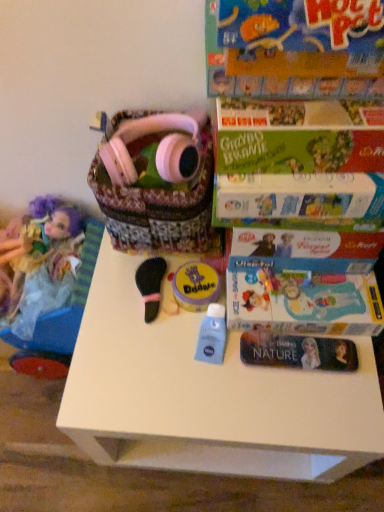
The height and width of the screenshot is (512, 384). What are the coordinates of `free location to the left of yellow matte doodle at center, the second toy when ordered from left to right` in the screenshot? It's located at (119, 304).